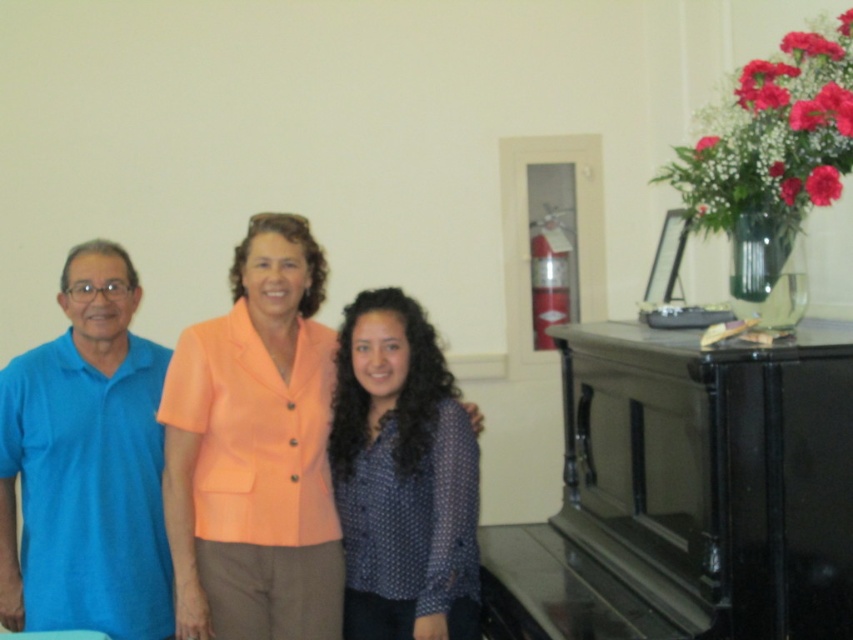
You are a photographer setting up for a group photo. You want to arrange the blue dotted shirt at center and the blue cotton shirt at left so that both are visible in the frame. Which shirt should be placed in the front to ensure the other is fully visible?

The blue dotted shirt at center should be placed in the front because it is shorter than the blue cotton shirt at left, allowing the taller blue cotton shirt at left to be fully visible behind it.